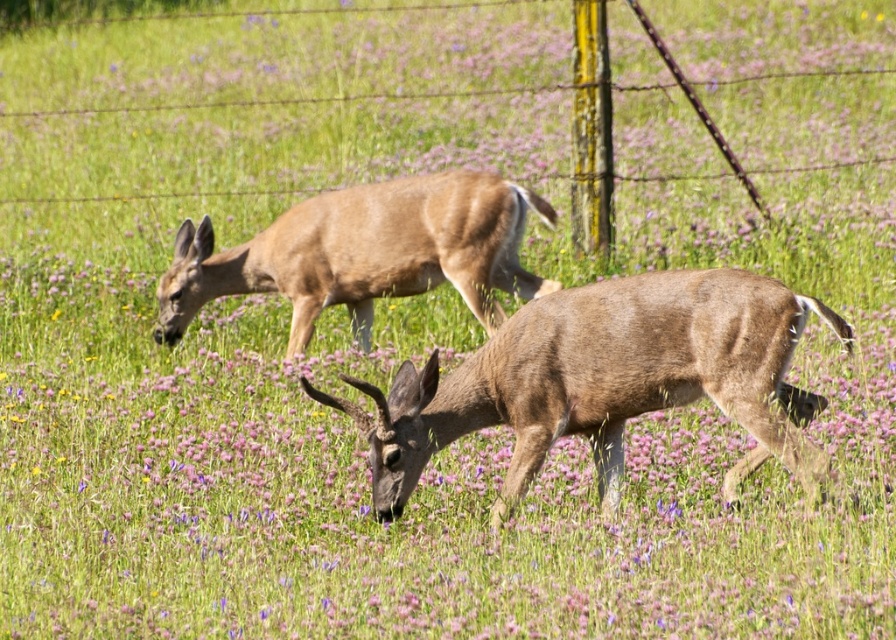
Question: Is brown matte/deer at center below brown matte deer at center?

Choices:
 (A) yes
 (B) no

Answer: (A)

Question: Can you confirm if brown matte/deer at center is positioned to the right of brown matte deer at center?

Choices:
 (A) yes
 (B) no

Answer: (A)

Question: Which object appears farthest from the camera in this image?

Choices:
 (A) brown matte/deer at center
 (B) brown matte deer at center

Answer: (B)

Question: Does brown matte/deer at center come behind brown matte deer at center?

Choices:
 (A) yes
 (B) no

Answer: (B)